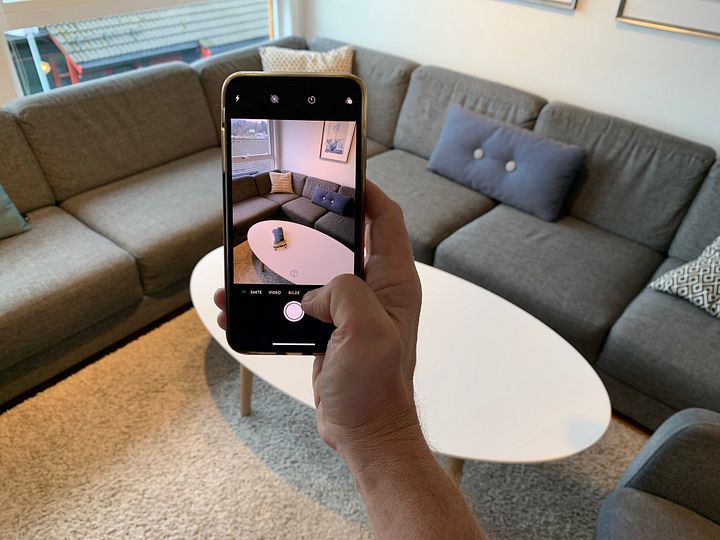
Where is `brown table leg`? Image resolution: width=720 pixels, height=540 pixels. brown table leg is located at coordinates (245, 384).